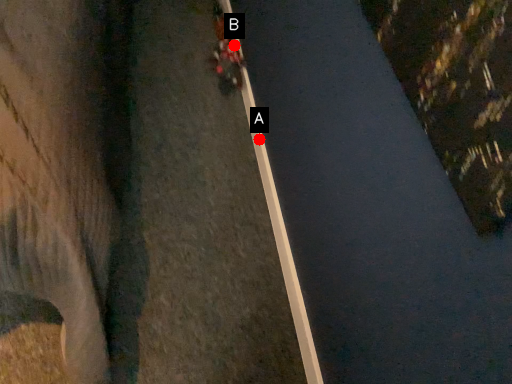
Question: Two points are circled on the image, labeled by A and B beside each circle. Which point is farther to the camera?

Choices:
 (A) A is further
 (B) B is further

Answer: (B)